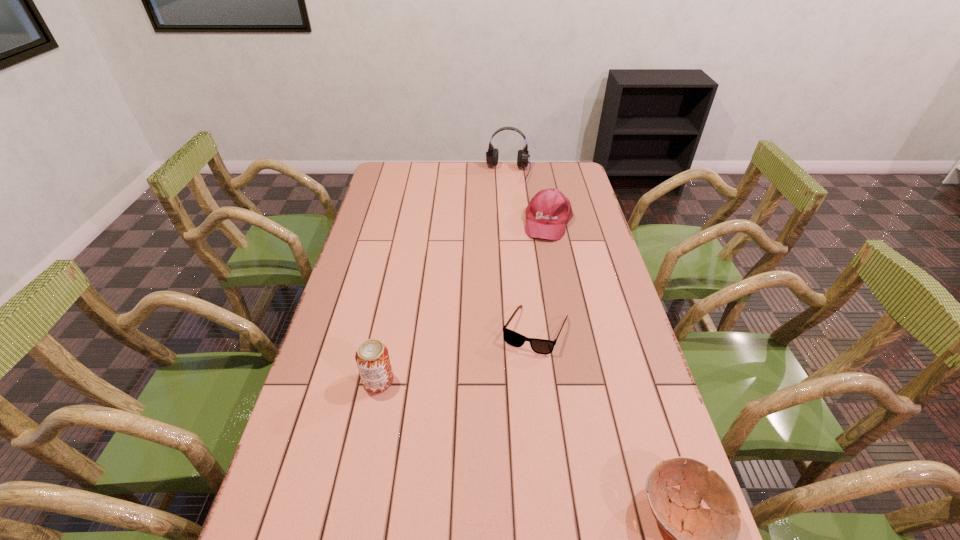
In the image, there is a desktop. Where is `vacant space at the far edge`? This screenshot has width=960, height=540. vacant space at the far edge is located at coordinates (525, 181).

The height and width of the screenshot is (540, 960). In the image, there is a desktop. In order to click on vacant region at the near edge in this screenshot , I will do `click(607, 530)`.

In the image, there is a desktop. Find the location of `vacant space at the left edge`. vacant space at the left edge is located at coordinates (376, 260).

The height and width of the screenshot is (540, 960). I want to click on vacant area at the right edge, so click(x=585, y=274).

Image resolution: width=960 pixels, height=540 pixels. In order to click on unoccupied area between the sunglasses and the tallest object in this screenshot , I will do `click(522, 252)`.

Locate an element on the screen. free point between the leftmost object and the shortest object is located at coordinates (457, 355).

Identify the location of vacant space that's between the shortest object and the baseball cap. This screenshot has height=540, width=960. (542, 276).

Locate an element on the screen. The image size is (960, 540). vacant space that is in between the headset and the fourth nearest object is located at coordinates (528, 198).

Find the location of a particular element. The height and width of the screenshot is (540, 960). object that stands as the second closest to the second nearest object is located at coordinates (696, 539).

Where is `object that stands as the third closest to the third farthest object`? Image resolution: width=960 pixels, height=540 pixels. object that stands as the third closest to the third farthest object is located at coordinates (696, 539).